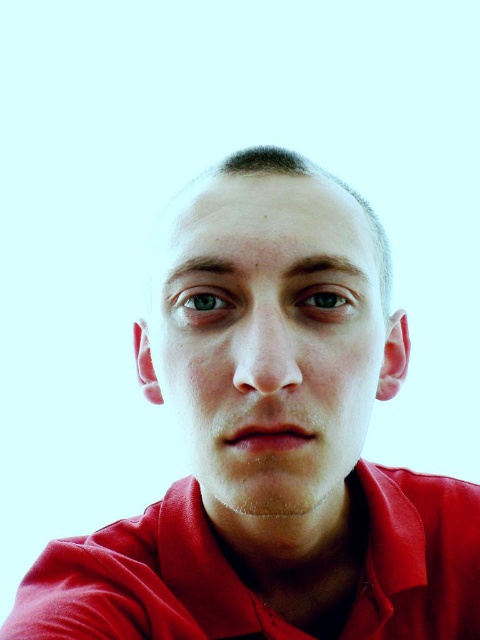
You are a fashion designer analyzing the placement of elements in a photo. In the image, there is a point marked at coordinates point (144, 582). Based on the scene description, can you identify what this point is indicating?

The point (144, 582) marks the location of the matte red polo shirt at center in the image.

You are an artist trying to paint a portrait. You have two colors, red and green. You want to ensure that the red area representing the face is larger than the green area for the eyes. Based on the image provided, does the matte red face at center meet this requirement when compared to the green matte eye at center?

The matte red face at center has a greater height compared to the green matte eye at center, so yes, the red area representing the face is larger than the green area for the eyes.

You are an assistant helping someone choose an outfit. The person wants to ensure their red polo shirt is visible in a photo. Based on the scene description, where should the matte red polo shirt at center be positioned relative to the green matte eye at center to ensure visibility?

The matte red polo shirt at center is below the green matte eye at center, so positioning it lower than the eye will ensure visibility as it is already placed below in the image.